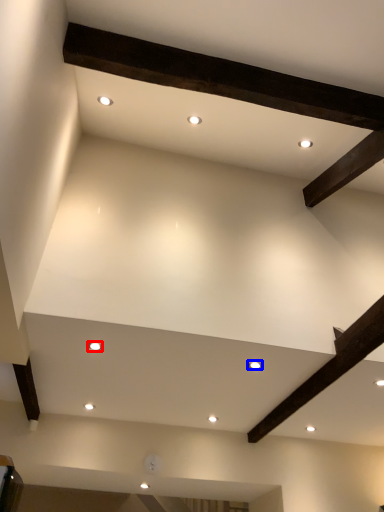
Question: Which point is further to the camera, lighting (highlighted by a red box) or lighting (highlighted by a blue box)?

Choices:
 (A) lighting
 (B) lighting

Answer: (B)